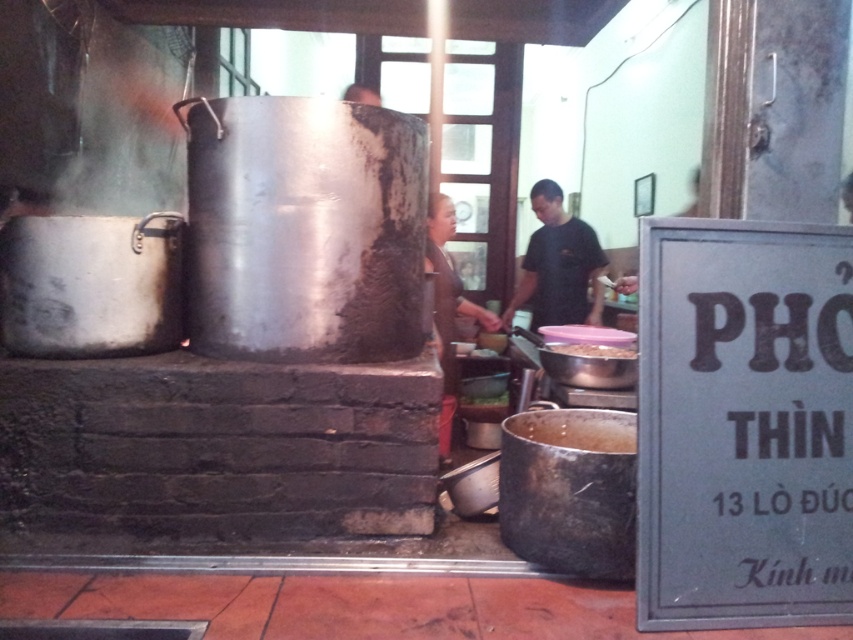
Question: Which point is closer to the camera taking this photo?

Choices:
 (A) (590, 356)
 (B) (589, 237)

Answer: (A)

Question: Considering the relative positions of black matte shirt at center and brown matte pot at center in the image provided, where is black matte shirt at center located with respect to brown matte pot at center?

Choices:
 (A) left
 (B) right

Answer: (B)

Question: Can you confirm if black matte shirt at center is smaller than white matte bowl at center?

Choices:
 (A) no
 (B) yes

Answer: (A)

Question: Which object is positioned closest to the matte silver pot at center?

Choices:
 (A) white matte bowl at center
 (B) brown matte pot at center
 (C) black matte shirt at center

Answer: (C)

Question: Does black matte shirt at center have a smaller size compared to white matte bowl at center?

Choices:
 (A) yes
 (B) no

Answer: (B)

Question: Which of these objects is positioned closest to the brown matte pot at center?

Choices:
 (A) black matte shirt at center
 (B) white matte bowl at center

Answer: (B)